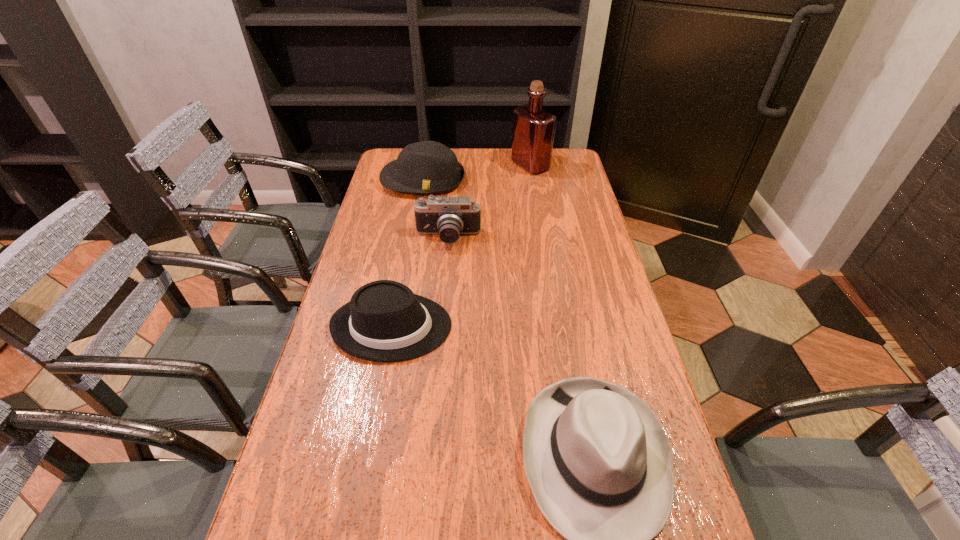
Image resolution: width=960 pixels, height=540 pixels. I want to click on object at the right edge, so click(x=533, y=128).

The width and height of the screenshot is (960, 540). In order to click on object that is at the far left corner in this screenshot , I will do `click(428, 167)`.

In order to click on object that is at the far right corner in this screenshot , I will do `click(533, 128)`.

Where is `vacant region at the left edge of the desktop`? This screenshot has width=960, height=540. vacant region at the left edge of the desktop is located at coordinates (409, 202).

In order to click on blank space at the right edge of the desktop in this screenshot , I will do `click(588, 368)`.

Find the location of a particular element. vacant area at the far right corner is located at coordinates [x=557, y=171].

The image size is (960, 540). Identify the location of empty space that is in between the farthest fedora and the tallest object. (477, 173).

Identify the location of unoccupied position between the tallest object and the camera. (490, 202).

Where is `vacant space that is in between the second nearest object and the third nearest object`? The height and width of the screenshot is (540, 960). vacant space that is in between the second nearest object and the third nearest object is located at coordinates (420, 282).

You are a GUI agent. You are given a task and a screenshot of the screen. Output one action in this format:
    pyautogui.click(x=<x>, y=<y>)
    Task: Click on the object that can be found as the closest to the third farthest object
    
    Given the screenshot: What is the action you would take?
    pyautogui.click(x=428, y=167)